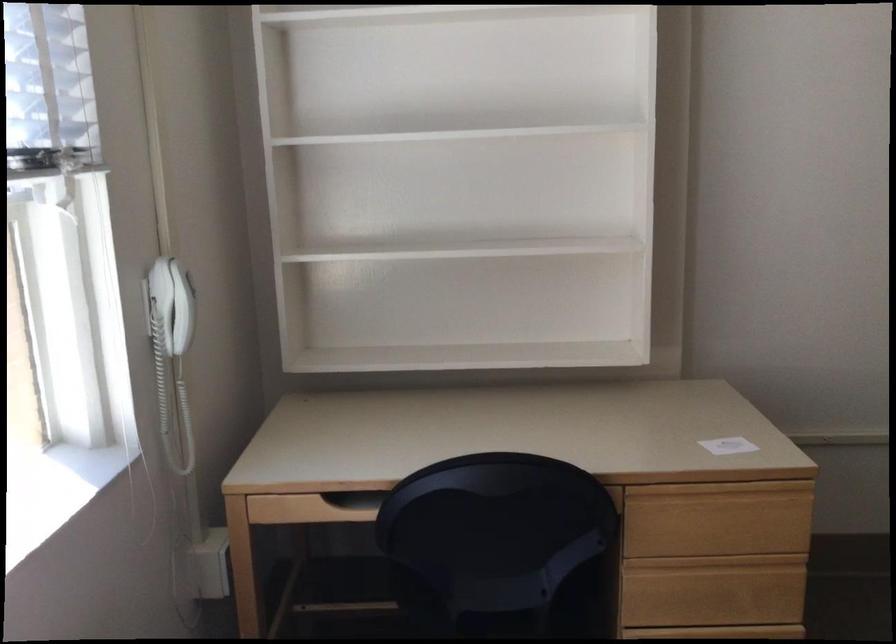
The image size is (896, 644). What do you see at coordinates (728, 446) in the screenshot?
I see `the white sticky note` at bounding box center [728, 446].